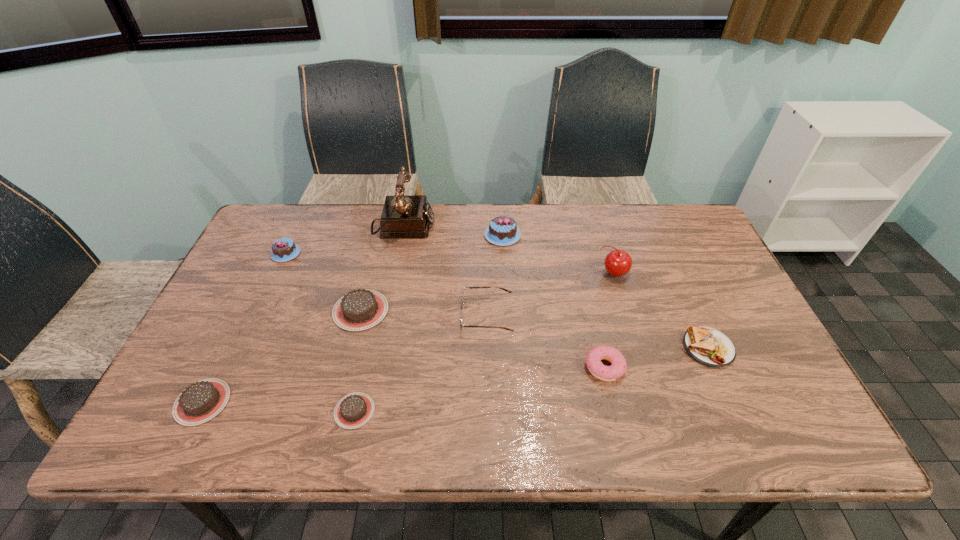
Find the location of `the closest chocolate cake to the smaller pink chocolate cake`. the closest chocolate cake to the smaller pink chocolate cake is located at coordinates tap(360, 309).

I want to click on the third closest chocolate cake to the brown spectacles, so [x=354, y=410].

Identify which brown chocolate cake is the second nearest to the leftmost brown chocolate cake. Please provide its 2D coordinates. Your answer should be formatted as a tuple, i.e. [(x, y)], where the tuple contains the x and y coordinates of a point satisfying the conditions above.

[(354, 410)]

Locate an element on the screen. Image resolution: width=960 pixels, height=540 pixels. brown chocolate cake identified as the closest to the brown spectacles is located at coordinates (360, 309).

I want to click on free space that satisfies the following two spatial constraints: 1. on the front-facing side of the spectacles; 2. on the back side of the rightmost object, so click(487, 348).

The width and height of the screenshot is (960, 540). Identify the location of vacant point that satisfies the following two spatial constraints: 1. on the front side of the cherry; 2. on the front-facing side of the brown spectacles. (626, 316).

Locate an element on the screen. The image size is (960, 540). free space that satisfies the following two spatial constraints: 1. on the back side of the rightmost object; 2. on the left side of the pink doughnut is located at coordinates (600, 348).

In order to click on vacant space that satisfies the following two spatial constraints: 1. on the dial of the brown telephone; 2. on the left side of the bigger pink chocolate cake in this screenshot , I will do point(401,235).

Where is `vacant space that satisfies the following two spatial constraints: 1. on the front-facing side of the pink doughnut; 2. on the right side of the spectacles`? This screenshot has height=540, width=960. vacant space that satisfies the following two spatial constraints: 1. on the front-facing side of the pink doughnut; 2. on the right side of the spectacles is located at coordinates (487, 367).